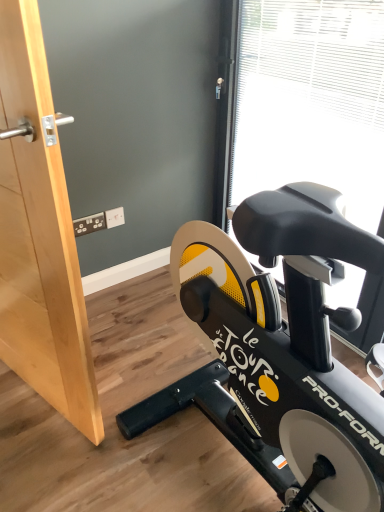
Question: From the image's perspective, is black matte stationary bicycle at lower right on top of transparent plastic window screen at upper right?

Choices:
 (A) yes
 (B) no

Answer: (B)

Question: Is black matte stationary bicycle at lower right to the right of transparent plastic window screen at upper right from the viewer's perspective?

Choices:
 (A) no
 (B) yes

Answer: (A)

Question: Could you tell me if black matte stationary bicycle at lower right is turned towards transparent plastic window screen at upper right?

Choices:
 (A) no
 (B) yes

Answer: (A)

Question: Considering the relative sizes of black matte stationary bicycle at lower right and transparent plastic window screen at upper right in the image provided, is black matte stationary bicycle at lower right bigger than transparent plastic window screen at upper right?

Choices:
 (A) yes
 (B) no

Answer: (B)

Question: Is black matte stationary bicycle at lower right smaller than transparent plastic window screen at upper right?

Choices:
 (A) yes
 (B) no

Answer: (A)

Question: Is wooden door at left bigger or smaller than black matte stationary bicycle at lower right?

Choices:
 (A) big
 (B) small

Answer: (A)

Question: Choose the correct answer: Is wooden door at left inside black matte stationary bicycle at lower right or outside it?

Choices:
 (A) inside
 (B) outside

Answer: (B)

Question: In terms of height, does wooden door at left look taller or shorter compared to black matte stationary bicycle at lower right?

Choices:
 (A) short
 (B) tall

Answer: (B)

Question: Is wooden door at left wider or thinner than black matte stationary bicycle at lower right?

Choices:
 (A) thin
 (B) wide

Answer: (A)

Question: From a real-world perspective, relative to black matte stationary bicycle at lower right, is transparent plastic window screen at upper right vertically above or below?

Choices:
 (A) below
 (B) above

Answer: (B)

Question: In terms of height, does transparent plastic window screen at upper right look taller or shorter compared to black matte stationary bicycle at lower right?

Choices:
 (A) short
 (B) tall

Answer: (B)

Question: Is point (286, 37) closer or farther from the camera than point (150, 407)?

Choices:
 (A) farther
 (B) closer

Answer: (A)

Question: From the image's perspective, is transparent plastic window screen at upper right above or below black matte stationary bicycle at lower right?

Choices:
 (A) above
 (B) below

Answer: (A)

Question: From a real-world perspective, relative to transparent plastic window screen at upper right, is wooden door at left vertically above or below?

Choices:
 (A) above
 (B) below

Answer: (A)

Question: Does point (61, 403) appear closer or farther from the camera than point (253, 88)?

Choices:
 (A) farther
 (B) closer

Answer: (B)